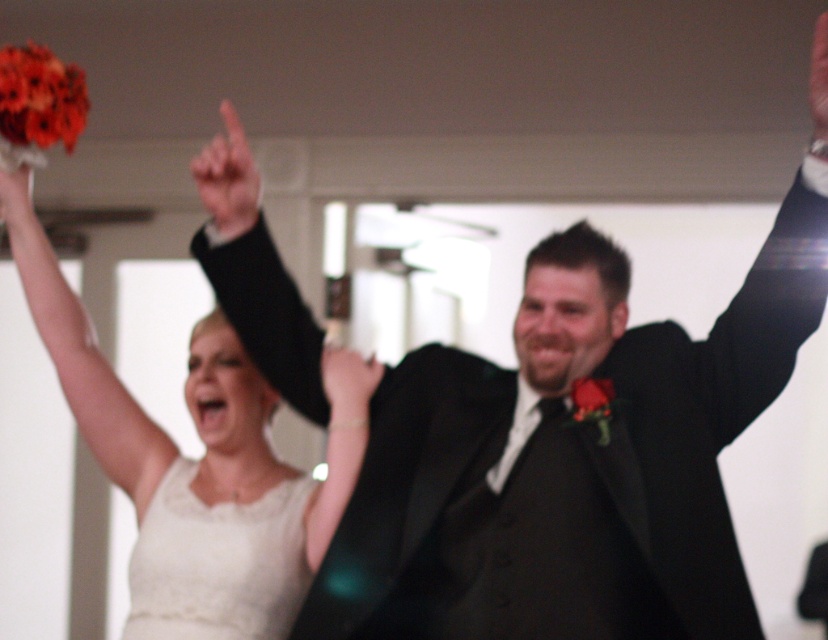
You are a photographer at a wedding reception. You need to capture a photo of the white lace dress at center and the matte black hand at upper center. Which object should you focus on first to ensure both are in sharp focus?

The white lace dress at center is closer to the viewer than the matte black hand at upper center. To ensure both are in sharp focus, you should focus on the white lace dress at center first, as it is closer, and the matte black hand at upper center will fall within the depth of field.

You are at a wedding reception and see two points marked in the image. The first point is at coordinate point(287, 490) and the second is at point(230, 125). Based on their positions, which point is closer to the bride?

Point(230, 125) is closer to the bride because it is in front of point(287, 490), which is behind it.

Based on the photo, you are a photographer at the wedding reception. You need to decide which of the two white matte arms in the image can fit a 10cm wide decorative ribbon. The two arms are the white matte arm at upper left and the white matte arm at upper center. Based on their widths, which one can accommodate the ribbon?

The white matte arm at upper left might be wider than white matte arm at upper center, so it can accommodate the 10cm wide decorative ribbon if it is indeed wider.